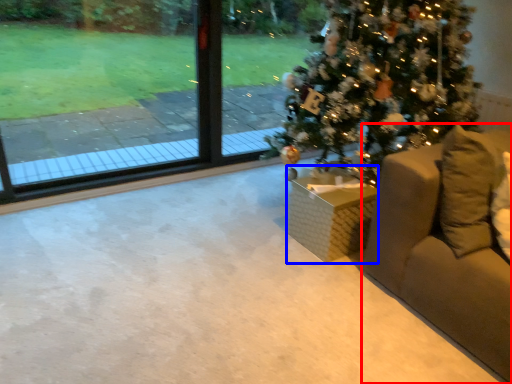
Question: Which point is further to the camera, furniture (highlighted by a red box) or furniture (highlighted by a blue box)?

Choices:
 (A) furniture
 (B) furniture

Answer: (B)